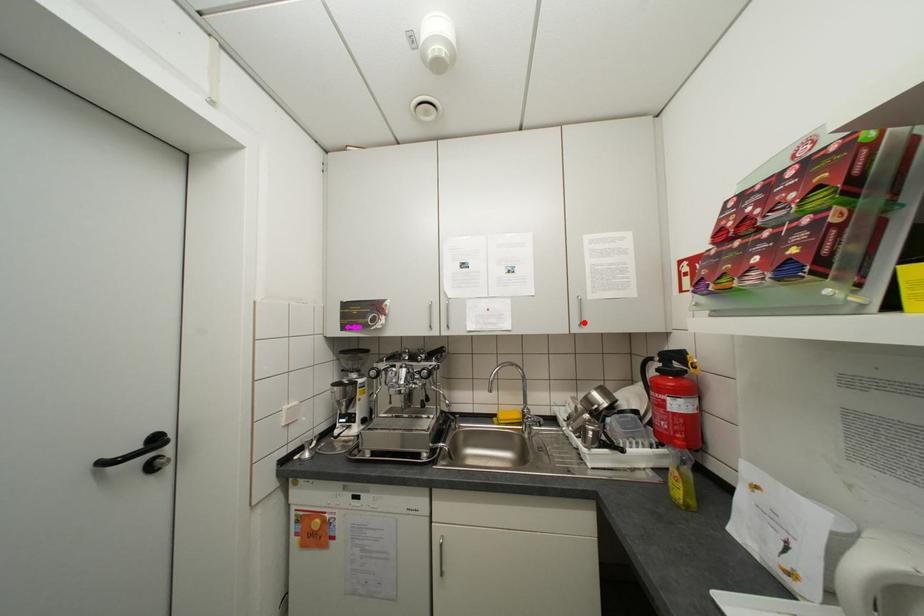
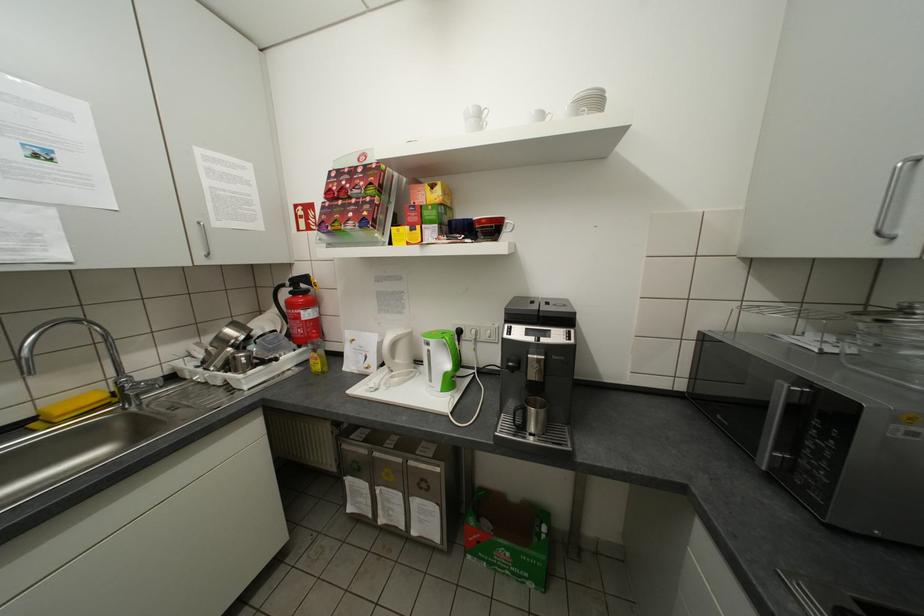
Question: I am providing you with two images of the same scene from different viewpoints. A red point is marked on the first image. Can you still see the location of the red point in image 2?

Choices:
 (A) Yes
 (B) No

Answer: (A)